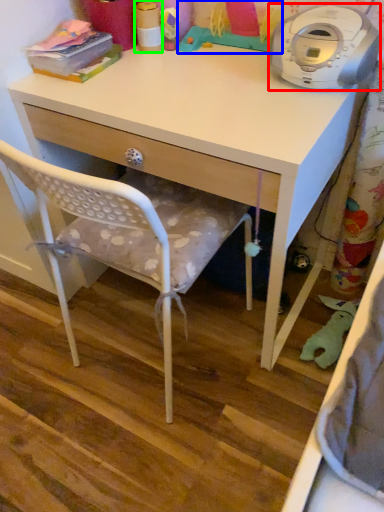
Question: Based on their relative distances, which object is nearer to home appliance (highlighted by a red box)? Choose from toy (highlighted by a blue box) and toy (highlighted by a green box).

Choices:
 (A) toy
 (B) toy

Answer: (A)